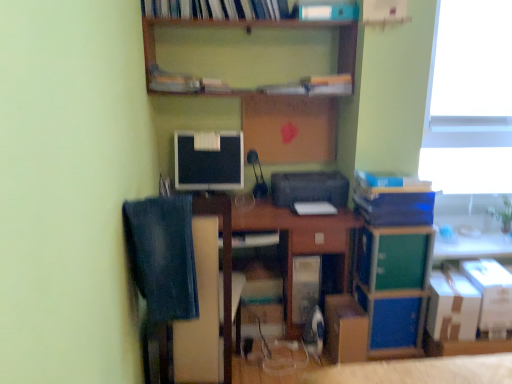
Question: Can you confirm if blue cardboard book at right, the third book in the left-to-right sequence, is bigger than satin black monitor at center?

Choices:
 (A) yes
 (B) no

Answer: (A)

Question: Is blue cardboard book at right, the third book in the left-to-right sequence, in contact with satin black monitor at center?

Choices:
 (A) no
 (B) yes

Answer: (A)

Question: Can you confirm if blue cardboard book at right, the second book positioned from the right, is positioned to the left of satin black monitor at center?

Choices:
 (A) yes
 (B) no

Answer: (B)

Question: Considering the relative sizes of blue cardboard book at right, which is counted as the 4th book, starting from the top, and satin black monitor at center in the image provided, is blue cardboard book at right, which is counted as the 4th book, starting from the top, wider than satin black monitor at center?

Choices:
 (A) no
 (B) yes

Answer: (B)

Question: From a real-world perspective, is blue cardboard book at right, the second book positioned from the right, located higher than satin black monitor at center?

Choices:
 (A) yes
 (B) no

Answer: (B)

Question: From the image's perspective, is white cardboard box at lower right, the third cardboard box positioned from the left, above or below blue matte book at upper right, acting as the third book starting from the top?

Choices:
 (A) below
 (B) above

Answer: (A)

Question: Considering the positions of point (503, 326) and point (375, 180), is point (503, 326) closer or farther from the camera than point (375, 180)?

Choices:
 (A) farther
 (B) closer

Answer: (B)

Question: Considering the relative positions of white cardboard box at lower right, arranged as the first cardboard box when viewed from the right, and blue matte book at upper right, which appears as the second book when ordered from the bottom, in the image provided, is white cardboard box at lower right, arranged as the first cardboard box when viewed from the right, to the left or to the right of blue matte book at upper right, which appears as the second book when ordered from the bottom,?

Choices:
 (A) right
 (B) left

Answer: (A)

Question: Is white cardboard box at lower right, arranged as the first cardboard box when viewed from the right, wider or thinner than blue matte book at upper right, acting as the third book starting from the top?

Choices:
 (A) thin
 (B) wide

Answer: (B)

Question: Would you say wooden desk at center is to the left or to the right of denim at left in the picture?

Choices:
 (A) left
 (B) right

Answer: (B)

Question: In terms of width, does wooden desk at center look wider or thinner when compared to denim at left?

Choices:
 (A) thin
 (B) wide

Answer: (B)

Question: From a real-world perspective, is wooden desk at center above or below denim at left?

Choices:
 (A) below
 (B) above

Answer: (A)

Question: Is point (287, 271) closer or farther from the camera than point (159, 289)?

Choices:
 (A) farther
 (B) closer

Answer: (A)

Question: Considering the relative positions of blue matte book at upper right, the 1th book from the right, and cardboard box at lower center, the first cardboard box in the left-to-right sequence, in the image provided, is blue matte book at upper right, the 1th book from the right, to the left or to the right of cardboard box at lower center, the first cardboard box in the left-to-right sequence,?

Choices:
 (A) left
 (B) right

Answer: (B)

Question: In the image, is blue matte book at upper right, which appears as the second book when ordered from the bottom, positioned in front of or behind cardboard box at lower center, the first cardboard box in the left-to-right sequence?

Choices:
 (A) front
 (B) behind

Answer: (A)